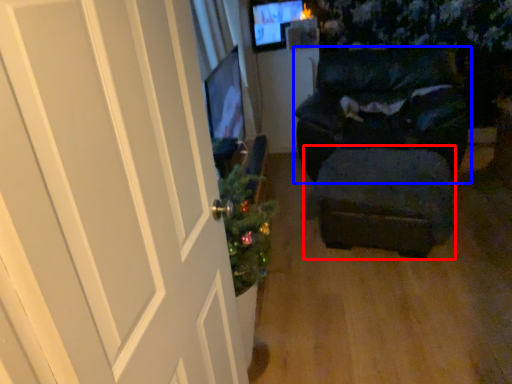
Question: Which object appears farthest to the camera in this image, stool (highlighted by a red box) or furniture (highlighted by a blue box)?

Choices:
 (A) stool
 (B) furniture

Answer: (B)